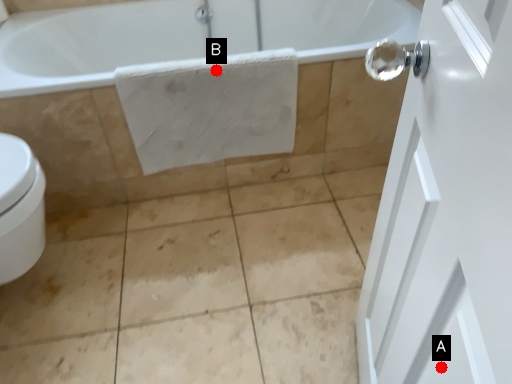
Question: Two points are circled on the image, labeled by A and B beside each circle. Which of the following is the closest to the observer?

Choices:
 (A) A is closer
 (B) B is closer

Answer: (A)